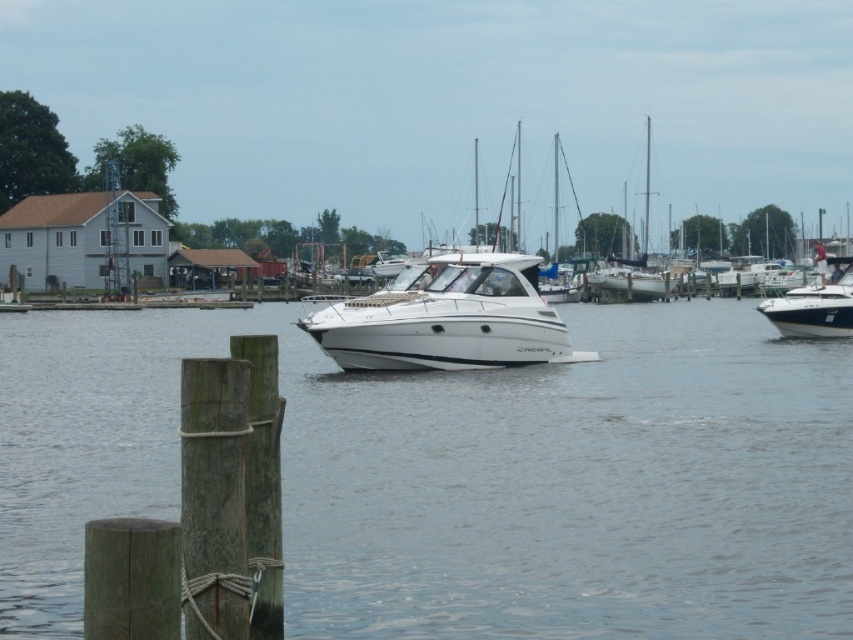
Based on the photo, is white glossy boat at center taller than white glossy boat at right?

Yes, white glossy boat at center is taller than white glossy boat at right.

How far apart are white glossy boat at center and white glossy boat at right?

A distance of 11.27 meters exists between white glossy boat at center and white glossy boat at right.

At what (x,y) coordinates should I click in order to perform the action: click on white glossy boat at center. Please return your answer as a coordinate pair (x, y). Looking at the image, I should click on (447, 317).

Does point (654, 568) lie behind point (790, 336)?

No.

How much distance is there between clear water at center and white glossy boat at right?

clear water at center and white glossy boat at right are 13.46 meters apart from each other.

Is point (447, 397) positioned after point (757, 308)?

That is False.

Locate an element on the screen. The width and height of the screenshot is (853, 640). clear water at center is located at coordinates (463, 476).

Between point (724, 468) and point (447, 346), which one is positioned behind?

Point (447, 346)

What do you see at coordinates (463, 476) in the screenshot?
I see `clear water at center` at bounding box center [463, 476].

What do you see at coordinates (463, 476) in the screenshot? I see `clear water at center` at bounding box center [463, 476].

Locate an element on the screen. The width and height of the screenshot is (853, 640). clear water at center is located at coordinates (463, 476).